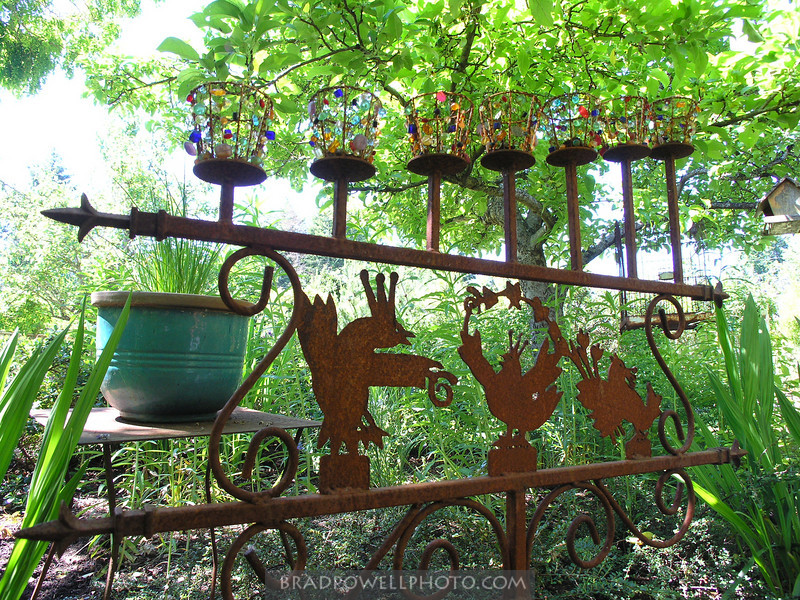
At what (x,y) coordinates should I click in order to perform the action: click on wire basket. Please return your answer as a coordinate pair (x, y). This screenshot has height=600, width=800. Looking at the image, I should click on (234, 143), (340, 127), (442, 138), (509, 128), (560, 128), (633, 124), (670, 126).